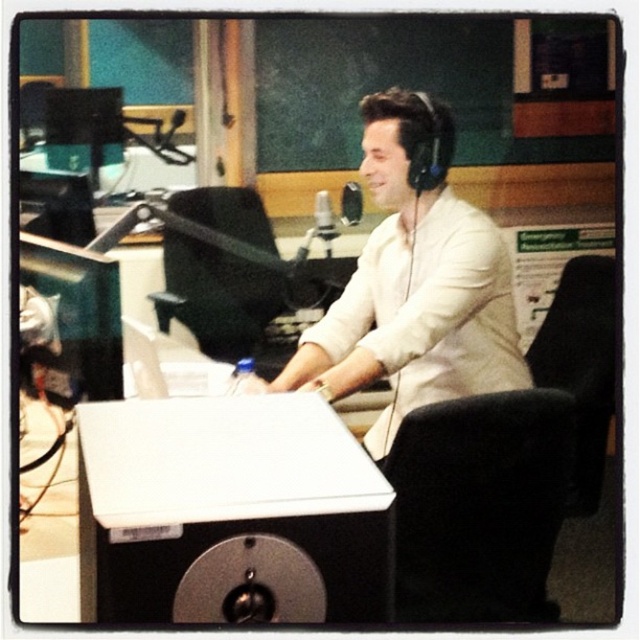
You are a costume designer preparing for a photoshoot in a radio studio. You need to ensure that the white matte shirt at center and the black leather chair at center are visible in the frame. Based on their sizes, which one should you focus on positioning first to ensure it doesn

The white matte shirt at center is bigger than the black leather chair at center, so you should focus on positioning the white matte shirt at center first to ensure it is properly framed.

You are standing in the studio and want to place a 1.5 meter long cable from your current position to the point at coordinates point (x=301, y=426). Is the cable long enough?

The point at coordinates point (x=301, y=426) is 1.08 meters away from the camera, so yes, the 1.5 meter cable is long enough to reach that point.